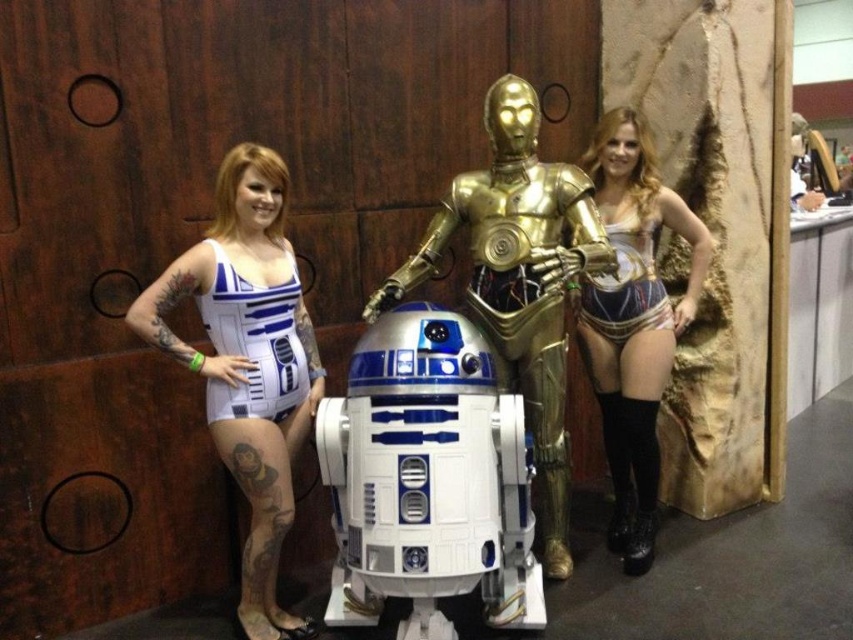
Is point (589, 260) positioned in front of point (671, 339)?

That is True.

Does gold metallic robot at center have a lesser height compared to matte gold bikini at center?

No.

The image size is (853, 640). Identify the location of gold metallic robot at center. (520, 280).

At what (x,y) coordinates should I click in order to perform the action: click on gold metallic robot at center. Please return your answer as a coordinate pair (x, y). Image resolution: width=853 pixels, height=640 pixels. Looking at the image, I should click on (520, 280).

Can you confirm if white matte bodysuit at left is thinner than gold metallic robot at center?

Indeed, white matte bodysuit at left has a lesser width compared to gold metallic robot at center.

Which of these two, white matte bodysuit at left or gold metallic robot at center, stands taller?

Standing taller between the two is gold metallic robot at center.

Describe the element at coordinates (248, 362) in the screenshot. I see `white matte bodysuit at left` at that location.

Locate an element on the screen. The width and height of the screenshot is (853, 640). white matte bodysuit at left is located at coordinates (248, 362).

Can you confirm if white matte bodysuit at left is wider than matte gold bikini at center?

Yes.

Who is more forward, (233, 244) or (648, 452)?

Point (233, 244)

What are the coordinates of `white matte bodysuit at left` in the screenshot? It's located at click(x=248, y=362).